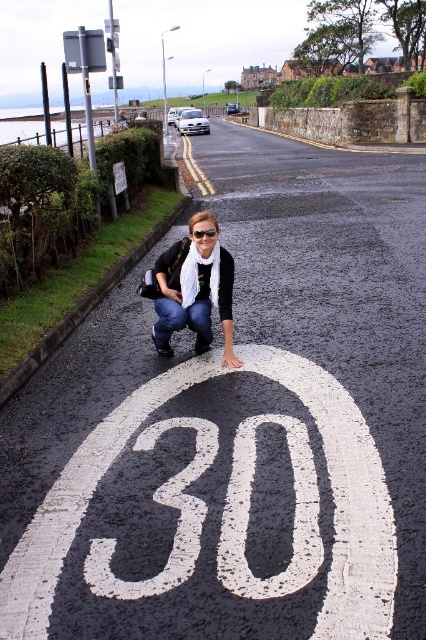
From the picture: Does white painted number at center appear on the left side of black plastic goggles at center?

In fact, white painted number at center is to the right of black plastic goggles at center.

Is white painted number at center taller than black plastic goggles at center?

Correct, white painted number at center is much taller as black plastic goggles at center.

The image size is (426, 640). What are the coordinates of `white painted number at center` in the screenshot? It's located at (250, 509).

Where is `matte black scarf at center`? Image resolution: width=426 pixels, height=640 pixels. matte black scarf at center is located at coordinates (192, 291).

Who is lower down, matte black scarf at center or gray asphalt curb at lower left?

matte black scarf at center is below.

Does point (201, 225) come farther from viewer compared to point (178, 214)?

That is False.

Where is `matte black scarf at center`? matte black scarf at center is located at coordinates (192, 291).

Can you confirm if white painted number at center is bigger than gray asphalt curb at lower left?

No.

Is point (175, 532) closer to viewer compared to point (100, 291)?

Yes, point (175, 532) is in front of point (100, 291).

Does point (287, 593) come behind point (172, 212)?

No, it is in front of (172, 212).

The width and height of the screenshot is (426, 640). I want to click on white painted number at center, so click(250, 509).